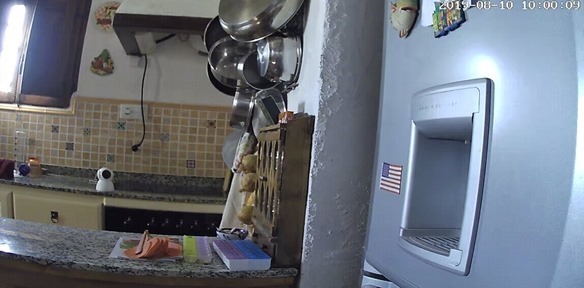
Locate an element on the screen. Image resolution: width=584 pixels, height=288 pixels. garbage disposal switch is located at coordinates (130, 118).